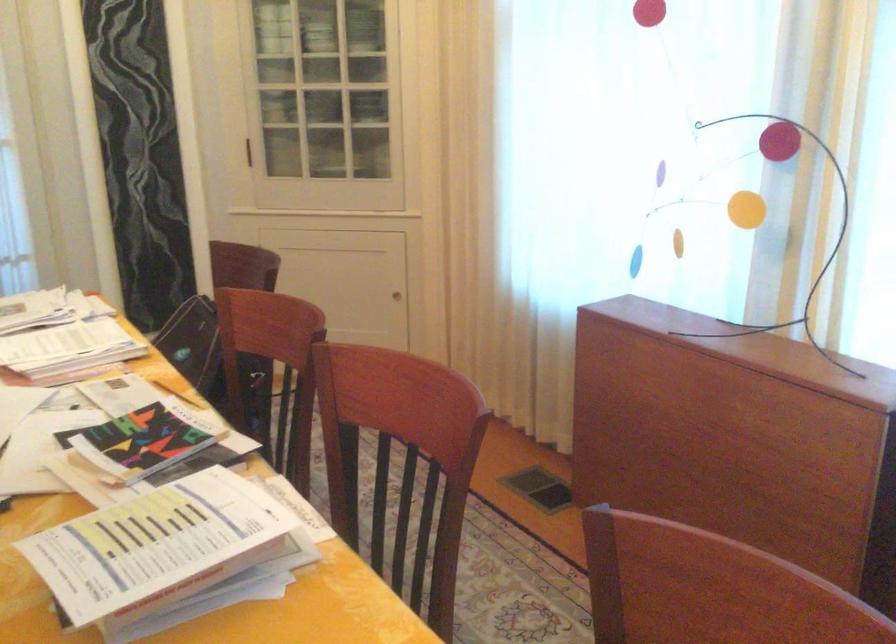
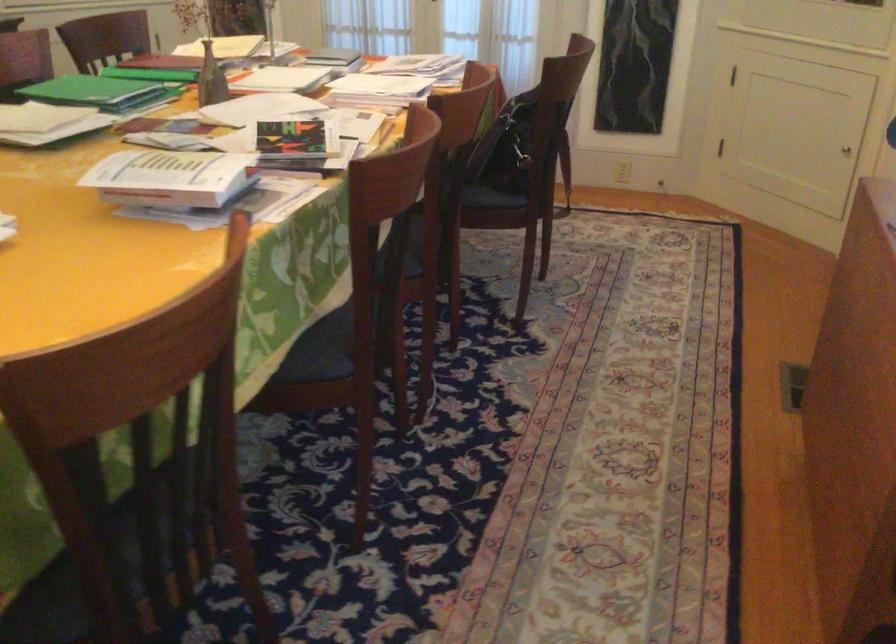
Find the pixel in the second image that matches (x=394, y=298) in the first image.

(846, 149)